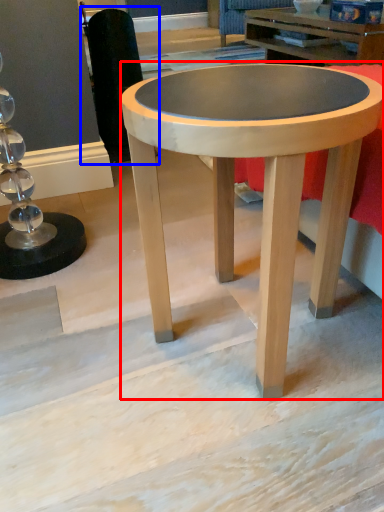
Question: Which point is closer to the camera, coffee table (highlighted by a red box) or swivel chair (highlighted by a blue box)?

Choices:
 (A) coffee table
 (B) swivel chair

Answer: (A)